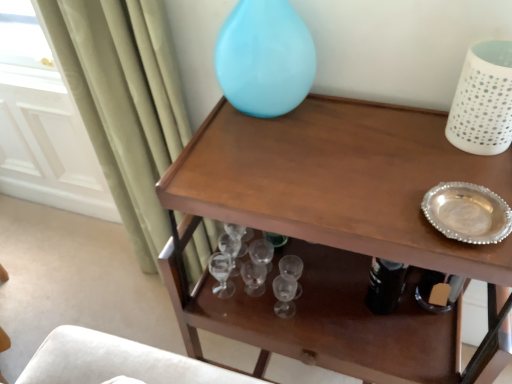
At what (x,y) coordinates should I click in order to perform the action: click on empty space that is ontop of wooden table at upper center (from a real-world perspective). Please return your answer as a coordinate pair (x, y). The image size is (512, 384). Looking at the image, I should click on click(x=350, y=163).